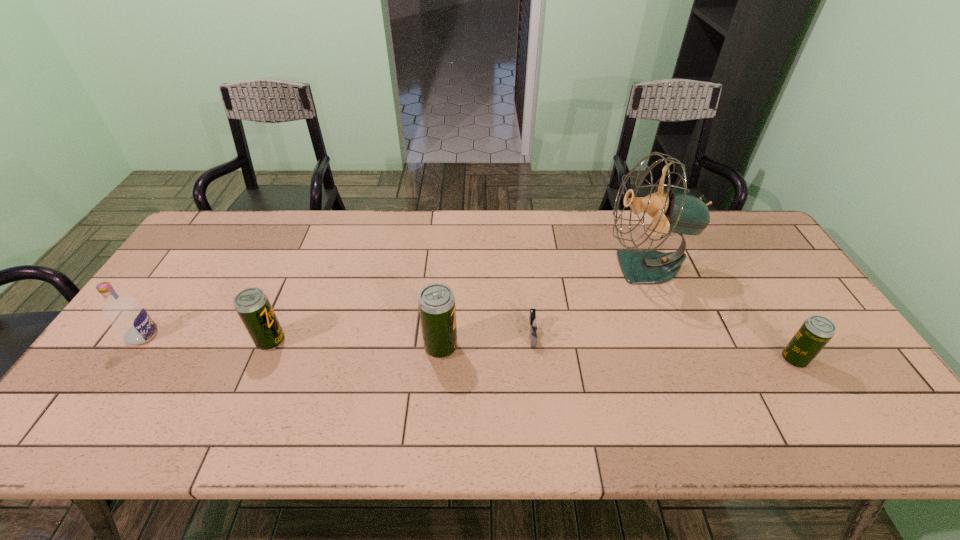
Find the location of a particular element. Image resolution: width=960 pixels, height=540 pixels. free space that satisfies the following two spatial constraints: 1. on the label of the vodka; 2. on the left side of the leftmost beer can is located at coordinates (139, 341).

Where is `vacant point that satisfies the following two spatial constraints: 1. on the label of the second beer can from right to left; 2. on the right side of the leftmost object`? vacant point that satisfies the following two spatial constraints: 1. on the label of the second beer can from right to left; 2. on the right side of the leftmost object is located at coordinates (135, 347).

Image resolution: width=960 pixels, height=540 pixels. Identify the location of blank area in the image that satisfies the following two spatial constraints: 1. on the label of the vodka; 2. on the right side of the second beer can from right to left. (135, 347).

Locate an element on the screen. free space that satisfies the following two spatial constraints: 1. on the label of the vodka; 2. on the left side of the second shortest beer can is located at coordinates (139, 341).

Locate an element on the screen. The image size is (960, 540). free space that satisfies the following two spatial constraints: 1. on the label of the rightmost beer can; 2. on the right side of the vodka is located at coordinates (127, 360).